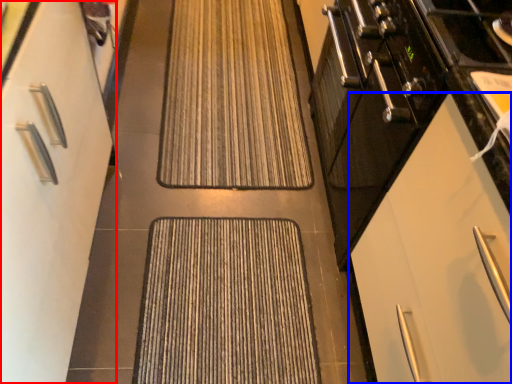
Question: Which point is closer to the camera, cabinetry (highlighted by a red box) or cabinetry (highlighted by a blue box)?

Choices:
 (A) cabinetry
 (B) cabinetry

Answer: (A)